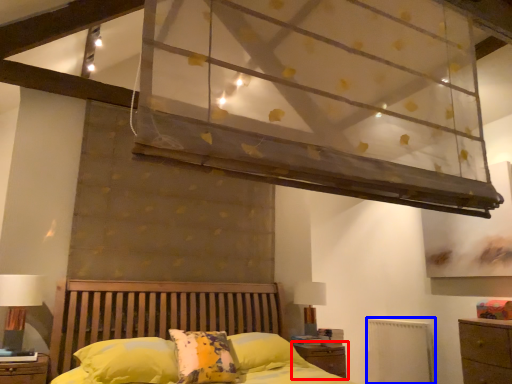
Question: Which of the following is the closest to the observer, nightstand (highlighted by a red box) or radiator (highlighted by a blue box)?

Choices:
 (A) nightstand
 (B) radiator

Answer: (A)